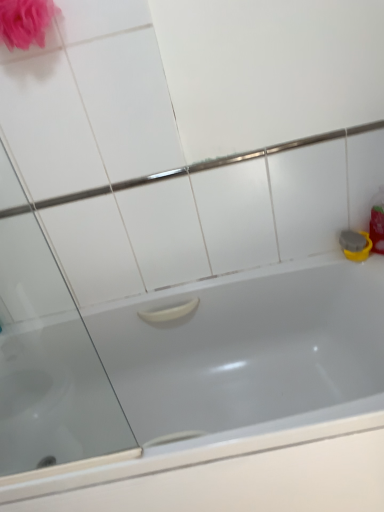
You are a GUI agent. You are given a task and a screenshot of the screen. Output one action in this format:
    pyautogui.click(x=<x>, y=<y>)
    Task: Click on the matte pink sponge at upper left
    The image size is (384, 512).
    Given the screenshot: What is the action you would take?
    pyautogui.click(x=25, y=22)

The height and width of the screenshot is (512, 384). Describe the element at coordinates (25, 22) in the screenshot. I see `matte pink sponge at upper left` at that location.

At what (x,y) coordinates should I click in order to perform the action: click on white glossy bathtub at center. Please return your answer as a coordinate pair (x, y). Looking at the image, I should click on (244, 395).

This screenshot has height=512, width=384. What do you see at coordinates (244, 395) in the screenshot?
I see `white glossy bathtub at center` at bounding box center [244, 395].

Image resolution: width=384 pixels, height=512 pixels. I want to click on matte pink sponge at upper left, so click(25, 22).

Based on the photo, can you confirm if matte pink sponge at upper left is positioned to the left of white glossy bathtub at center?

Yes, matte pink sponge at upper left is to the left of white glossy bathtub at center.

Which object is closer to the camera taking this photo, matte pink sponge at upper left or white glossy bathtub at center?

white glossy bathtub at center is more forward.

Which is closer to the camera, (40,26) or (332,498)?

Point (40,26) is closer to the camera than point (332,498).

From the image's perspective, is matte pink sponge at upper left located beneath white glossy bathtub at center?

No, from the image's perspective, matte pink sponge at upper left is not beneath white glossy bathtub at center.

From a real-world perspective, which is physically above, matte pink sponge at upper left or white glossy bathtub at center?

matte pink sponge at upper left is physically above.

Is matte pink sponge at upper left wider or thinner than white glossy bathtub at center?

Clearly, matte pink sponge at upper left has less width compared to white glossy bathtub at center.

In the scene shown: Who is taller, matte pink sponge at upper left or white glossy bathtub at center?

white glossy bathtub at center.

Does matte pink sponge at upper left have a smaller size compared to white glossy bathtub at center?

Indeed, matte pink sponge at upper left has a smaller size compared to white glossy bathtub at center.

Is matte pink sponge at upper left inside or outside of white glossy bathtub at center?

matte pink sponge at upper left cannot be found inside white glossy bathtub at center.

Is matte pink sponge at upper left far from white glossy bathtub at center?

matte pink sponge at upper left is positioned a significant distance from white glossy bathtub at center.

Is matte pink sponge at upper left aimed at white glossy bathtub at center?

No, matte pink sponge at upper left does not turn towards white glossy bathtub at center.

How different are the orientations of matte pink sponge at upper left and white glossy bathtub at center in degrees?

0.779 degrees separate the facing orientations of matte pink sponge at upper left and white glossy bathtub at center.

This screenshot has height=512, width=384. Identify the location of rose above the white glossy bathtub at center (from a real-world perspective). (25, 22).

Which object is positioned more to the right, white glossy bathtub at center or matte pink sponge at upper left?

From the viewer's perspective, white glossy bathtub at center appears more on the right side.

Which object is closer to the camera, white glossy bathtub at center or matte pink sponge at upper left?

white glossy bathtub at center is in front.

Which is behind, point (263, 401) or point (19, 11)?

The point (263, 401) is farther.

From the image's perspective, which one is positioned higher, white glossy bathtub at center or matte pink sponge at upper left?

matte pink sponge at upper left, from the image's perspective.

From a real-world perspective, who is located lower, white glossy bathtub at center or matte pink sponge at upper left?

From a 3D spatial view, white glossy bathtub at center is below.

In terms of width, does white glossy bathtub at center look wider or thinner when compared to matte pink sponge at upper left?

Clearly, white glossy bathtub at center has more width compared to matte pink sponge at upper left.

Does white glossy bathtub at center have a lesser height compared to matte pink sponge at upper left?

No.

Considering the sizes of white glossy bathtub at center and matte pink sponge at upper left in the image, is white glossy bathtub at center bigger or smaller than matte pink sponge at upper left?

Considering their sizes, white glossy bathtub at center takes up more space than matte pink sponge at upper left.

Is white glossy bathtub at center inside or outside of matte pink sponge at upper left?

white glossy bathtub at center is not enclosed by matte pink sponge at upper left.

Is white glossy bathtub at center far away from matte pink sponge at upper left?

Yes.

Is white glossy bathtub at center positioned with its back to matte pink sponge at upper left?

No, white glossy bathtub at center is not facing away from matte pink sponge at upper left.

In the scene shown: Can you tell me how much white glossy bathtub at center and matte pink sponge at upper left differ in facing direction?

0.779 degrees.

Where is `bathtub in front of the matte pink sponge at upper left`? This screenshot has height=512, width=384. bathtub in front of the matte pink sponge at upper left is located at coordinates (244, 395).

The height and width of the screenshot is (512, 384). In order to click on bathtub beneath the matte pink sponge at upper left (from a real-world perspective) in this screenshot , I will do `click(244, 395)`.

This screenshot has width=384, height=512. Identify the location of bathtub located in front of the matte pink sponge at upper left. (244, 395).